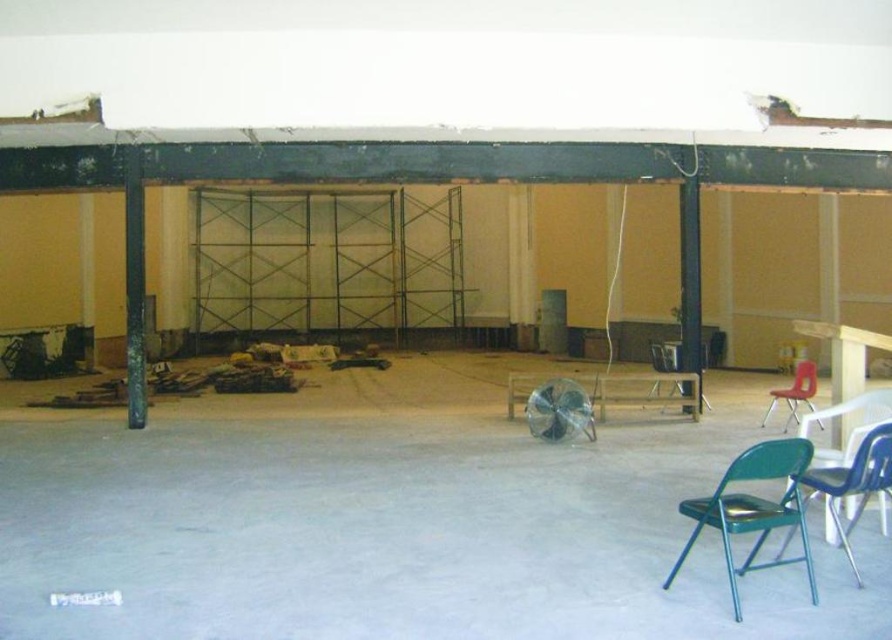
Question: Which object appears farthest from the camera in this image?

Choices:
 (A) green metallic beam at left
 (B) metallic silver chair at center
 (C) metallic blue chair at lower right

Answer: (B)

Question: Does metallic teal folding chair at lower right appear on the right side of metallic silver chair at center?

Choices:
 (A) no
 (B) yes

Answer: (A)

Question: Does green metallic beam at left have a lesser width compared to metallic silver chair at center?

Choices:
 (A) no
 (B) yes

Answer: (A)

Question: Which point is farther to the camera?

Choices:
 (A) (135, 188)
 (B) (827, 480)
 (C) (731, 508)
 (D) (649, 342)

Answer: (D)

Question: Among these objects, which one is farthest from the camera?

Choices:
 (A) metallic teal folding chair at lower right
 (B) metallic blue chair at lower right
 (C) metallic silver chair at center

Answer: (C)

Question: Can you confirm if green metallic beam at left is thinner than metallic blue chair at lower right?

Choices:
 (A) yes
 (B) no

Answer: (B)